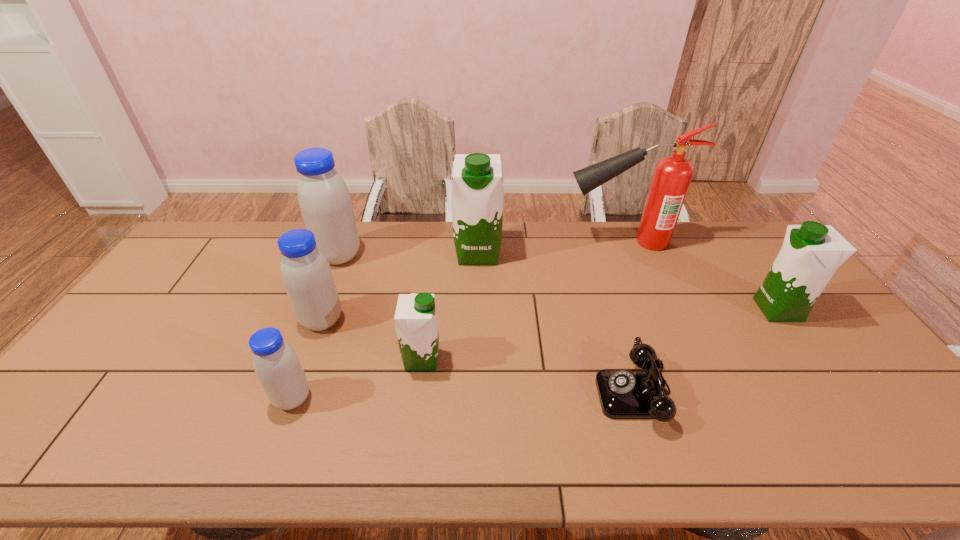
Where is `vacant region located on the front-facing side of the rightmost soya milk`? Image resolution: width=960 pixels, height=540 pixels. vacant region located on the front-facing side of the rightmost soya milk is located at coordinates tap(696, 310).

I want to click on vacant space situated on the back of the second farthest blue soya milk, so click(x=343, y=264).

The image size is (960, 540). In order to click on free location located on the front-facing side of the fourth object from left to right in this screenshot , I will do `click(504, 360)`.

The image size is (960, 540). I want to click on vacant space located 0.210m on the back of the nearest soya milk, so click(x=321, y=322).

Identify the location of vacant space situated 0.380m on the dial of the black telephone. Image resolution: width=960 pixels, height=540 pixels. (446, 393).

At what (x,y) coordinates should I click in order to perform the action: click on vacant space positioned on the dial of the black telephone. Please return your answer as a coordinate pair (x, y). Image resolution: width=960 pixels, height=540 pixels. Looking at the image, I should click on (x=526, y=393).

Find the location of a particular element. This screenshot has width=960, height=540. vacant space situated on the dial of the black telephone is located at coordinates (478, 393).

This screenshot has width=960, height=540. What are the coordinates of `fire extinguisher positioned at the far edge` in the screenshot? It's located at (672, 175).

This screenshot has height=540, width=960. What are the coordinates of `object situated at the near edge` in the screenshot? It's located at (624, 393).

Locate an element on the screen. This screenshot has width=960, height=540. object that is at the right edge is located at coordinates (811, 253).